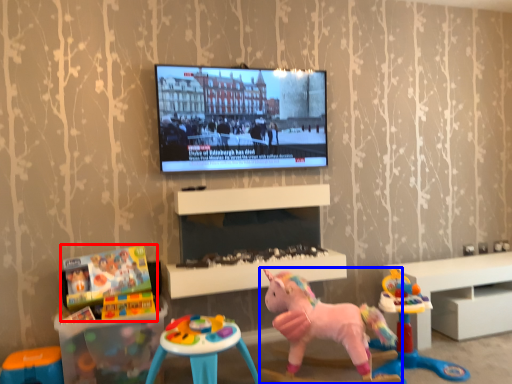
Question: Which of the following is the farthest to the observer, toy (highlighted by a red box) or toy (highlighted by a blue box)?

Choices:
 (A) toy
 (B) toy

Answer: (A)